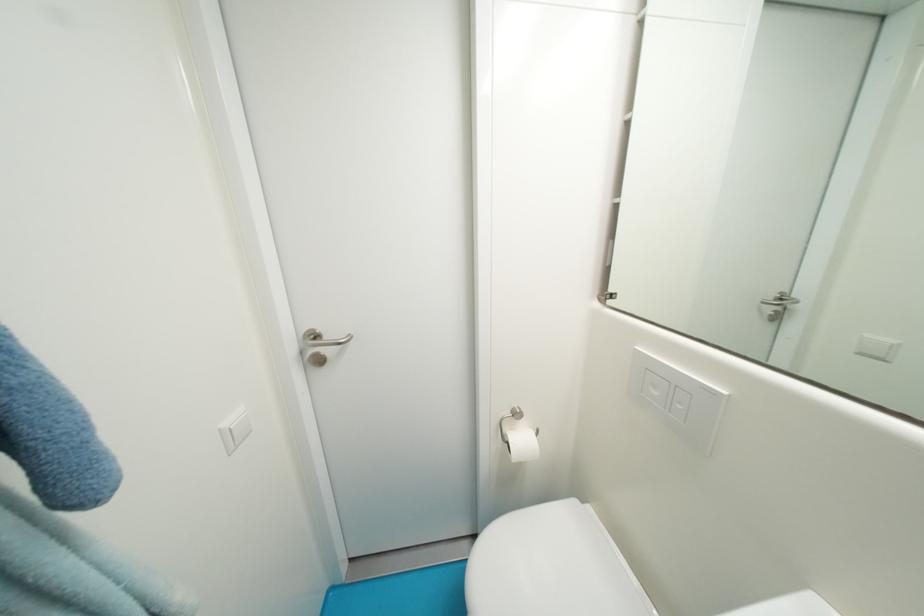
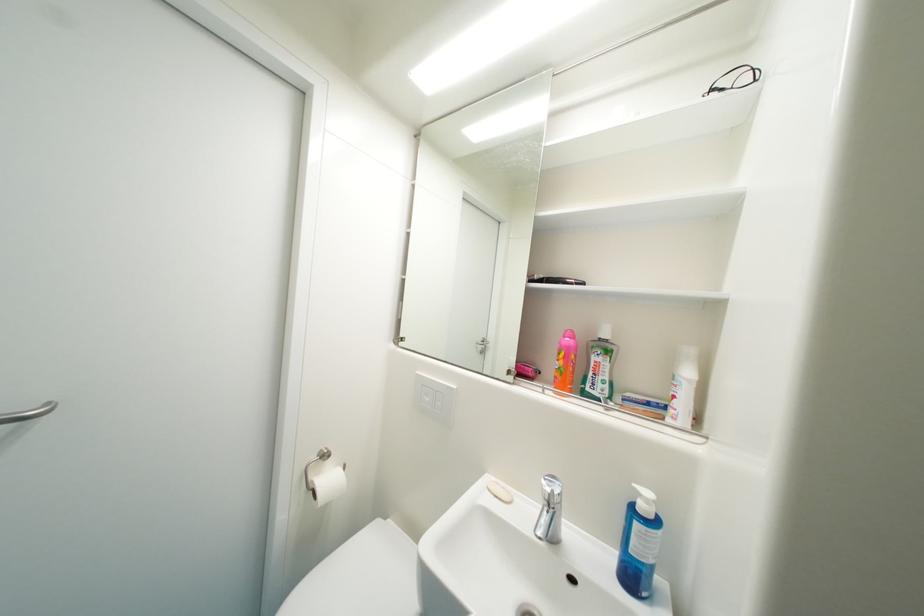
Locate, in the second image, the point that corresponds to point 616,304 in the first image.

(407, 345)